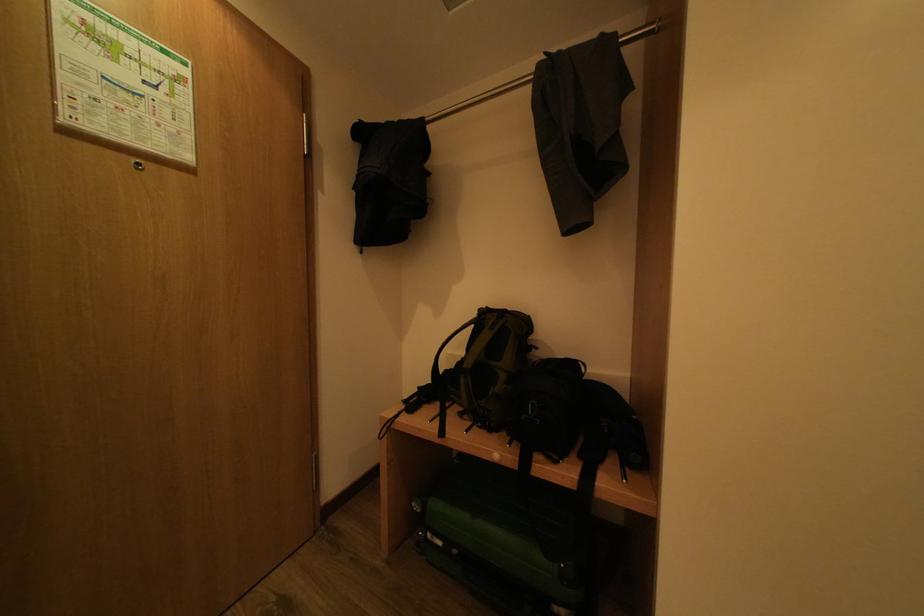
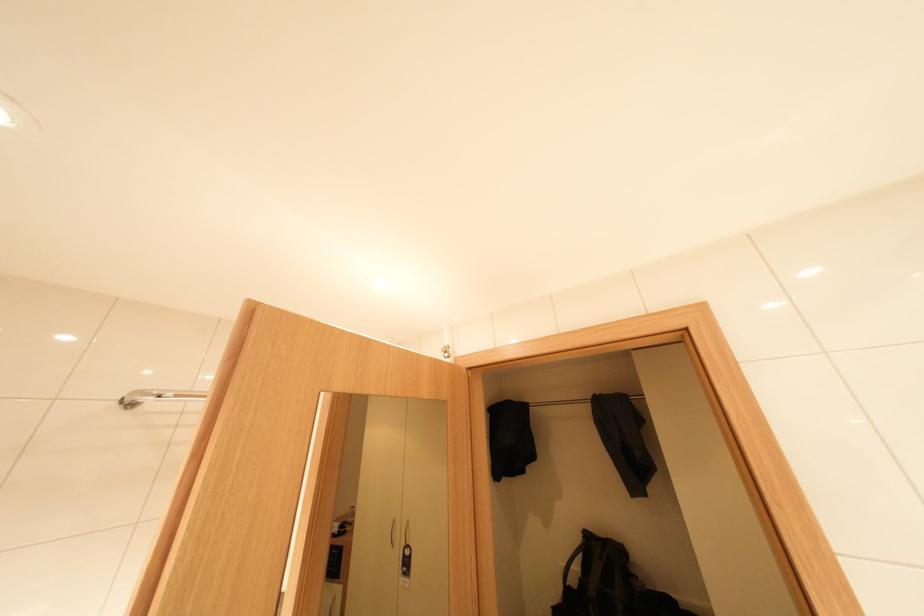
In the second image, find the point that corresponds to point (434, 119) in the first image.

(540, 403)